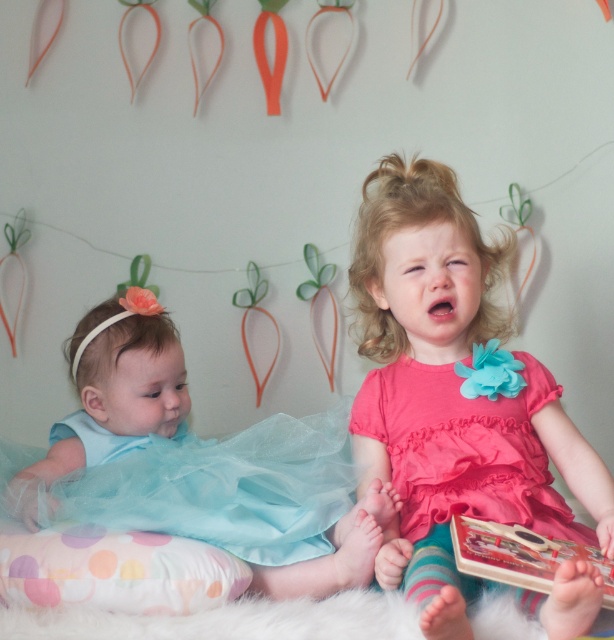
Does light blue tulle dress at lower left come in front of hardcover book at lower right?

No, light blue tulle dress at lower left is further to the viewer.

Is light blue tulle dress at lower left taller than hardcover book at lower right?

Correct, light blue tulle dress at lower left is much taller as hardcover book at lower right.

This screenshot has height=640, width=614. I want to click on light blue tulle dress at lower left, so click(200, 465).

Where is `light blue tulle dress at lower left`? The height and width of the screenshot is (640, 614). light blue tulle dress at lower left is located at coordinates (200, 465).

Does point (406, 474) come in front of point (478, 540)?

No, it is not.

Between pink satin dress at center and hardcover book at lower right, which one has more height?

pink satin dress at center

Locate an element on the screen. pink satin dress at center is located at coordinates (451, 394).

You are a GUI agent. You are given a task and a screenshot of the screen. Output one action in this format:
    pyautogui.click(x=<x>, y=<y>)
    Task: Click on the pink satin dress at center
    The image size is (614, 640).
    Given the screenshot: What is the action you would take?
    pyautogui.click(x=451, y=394)

Is pink satin dress at center to the right of light blue tulle dress at lower left from the viewer's perspective?

Correct, you'll find pink satin dress at center to the right of light blue tulle dress at lower left.

Who is taller, pink satin dress at center or light blue tulle dress at lower left?

pink satin dress at center is taller.

Is point (413, 285) positioned in front of point (41, 481)?

No, (413, 285) is further to viewer.

Image resolution: width=614 pixels, height=640 pixels. I want to click on pink satin dress at center, so click(451, 394).